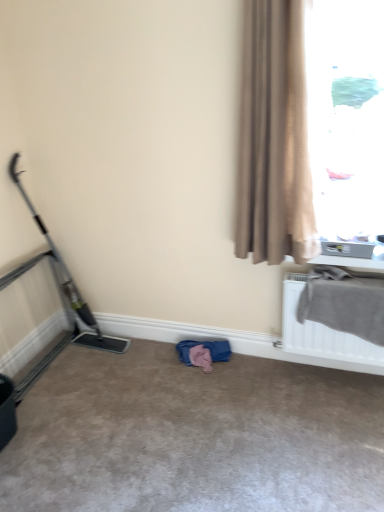
I want to click on beige textured curtain at right, so click(275, 136).

This screenshot has height=512, width=384. What do you see at coordinates (194, 436) in the screenshot?
I see `beige carpet at center` at bounding box center [194, 436].

Where is `gray fabric at upper right`? Image resolution: width=384 pixels, height=512 pixels. gray fabric at upper right is located at coordinates (321, 333).

Locate an element on the screen. Image resolution: width=384 pixels, height=512 pixels. beige textured curtain at right is located at coordinates (275, 136).

Do you think beige carpet at center is within beige textured curtain at right, or outside of it?

beige carpet at center is located beyond the bounds of beige textured curtain at right.

Measure the distance between beige carpet at center and beige textured curtain at right.

beige carpet at center and beige textured curtain at right are 3.62 feet apart.

Between beige carpet at center and beige textured curtain at right, which one appears on the right side from the viewer's perspective?

beige textured curtain at right is more to the right.

Is beige carpet at center beside beige textured curtain at right?

No, beige carpet at center is not next to beige textured curtain at right.

From a real-world perspective, between translucent glass window at upper right and gray fabric at upper right, who is vertically lower?

From a 3D spatial view, gray fabric at upper right is below.

Is gray fabric at upper right at the back of translucent glass window at upper right?

No, translucent glass window at upper right's orientation is not away from gray fabric at upper right.

Can you confirm if translucent glass window at upper right is positioned to the right of gray fabric at upper right?

Yes.

Considering the relative sizes of beige carpet at center and translucent glass window at upper right in the image provided, is beige carpet at center bigger than translucent glass window at upper right?

Incorrect, beige carpet at center is not larger than translucent glass window at upper right.

Between point (205, 481) and point (362, 96), which one is positioned in front?

The point (205, 481) is closer.

Between beige carpet at center and translucent glass window at upper right, which one appears on the right side from the viewer's perspective?

translucent glass window at upper right.

From the image's perspective, is metallic gray baby carriage at left on beige carpet at center?

Indeed, from the image's perspective, metallic gray baby carriage at left is shown above beige carpet at center.

Is metallic gray baby carriage at left smaller than beige carpet at center?

Yes.

Can you see translucent glass window at upper right touching beige textured curtain at right?

translucent glass window at upper right and beige textured curtain at right are not in contact.

Is point (367, 232) positioned behind point (279, 27)?

Yes, point (367, 232) is behind point (279, 27).

Is translucent glass window at upper right taller or shorter than beige textured curtain at right?

Clearly, translucent glass window at upper right is shorter compared to beige textured curtain at right.

Does point (363, 359) appear closer or farther from the camera than point (33, 372)?

Point (363, 359) is positioned closer to the camera compared to point (33, 372).

Is gray fabric at upper right bigger than metallic gray baby carriage at left?

Incorrect, gray fabric at upper right is not larger than metallic gray baby carriage at left.

Relative to metallic gray baby carriage at left, is gray fabric at upper right in front or behind?

Clearly, gray fabric at upper right is in front of metallic gray baby carriage at left.

Could you tell me if gray fabric at upper right is facing metallic gray baby carriage at left?

No, gray fabric at upper right does not turn towards metallic gray baby carriage at left.

Which is more to the left, beige carpet at center or gray fabric at upper right?

Positioned to the left is beige carpet at center.

Considering the positions of objects beige carpet at center and gray fabric at upper right in the image provided, who is in front, beige carpet at center or gray fabric at upper right?

beige carpet at center is closer to the camera.

Is point (221, 461) closer or farther from the camera than point (320, 349)?

Point (221, 461) is positioned closer to the camera compared to point (320, 349).

How different are the orientations of beige carpet at center and gray fabric at upper right in degrees?

There is a 87.4-degree angle between the facing directions of beige carpet at center and gray fabric at upper right.

Identify the location of concrete that appears below the beige textured curtain at right (from a real-world perspective). The image size is (384, 512). (194, 436).

The image size is (384, 512). Find the location of `radiator on the left of translucent glass window at upper right`. radiator on the left of translucent glass window at upper right is located at coordinates (321, 333).

When comparing their distances from beige carpet at center, does metallic gray baby carriage at left or gray fabric at upper right seem closer?

gray fabric at upper right is positioned closer to the anchor beige carpet at center.

Which object lies nearer to the anchor point metallic gray baby carriage at left, translucent glass window at upper right or beige textured curtain at right?

beige textured curtain at right is closer to metallic gray baby carriage at left.

Based on their spatial positions, is beige textured curtain at right or gray fabric at upper right closer to metallic gray baby carriage at left?

Based on the image, gray fabric at upper right appears to be nearer to metallic gray baby carriage at left.

When comparing their distances from translucent glass window at upper right, does beige textured curtain at right or gray fabric at upper right seem closer?

beige textured curtain at right lies closer to translucent glass window at upper right than the other object.

From the image, which object appears to be nearer to beige carpet at center, translucent glass window at upper right or metallic gray baby carriage at left?

Among the two, metallic gray baby carriage at left is located nearer to beige carpet at center.

From the image, which object appears to be nearer to metallic gray baby carriage at left, gray fabric at upper right or beige textured curtain at right?

gray fabric at upper right is closer to metallic gray baby carriage at left.

Considering their positions, is metallic gray baby carriage at left positioned closer to beige carpet at center than beige textured curtain at right?

metallic gray baby carriage at left lies closer to beige carpet at center than the other object.

Which object lies nearer to the anchor point beige textured curtain at right, translucent glass window at upper right or metallic gray baby carriage at left?

translucent glass window at upper right is closer to beige textured curtain at right.

In order to click on radiator between translucent glass window at upper right and beige carpet at center in the vertical direction in this screenshot , I will do `click(321, 333)`.

Locate an element on the screen. curtain between translucent glass window at upper right and gray fabric at upper right from top to bottom is located at coordinates (275, 136).

Locate an element on the screen. The width and height of the screenshot is (384, 512). curtain situated between metallic gray baby carriage at left and gray fabric at upper right from left to right is located at coordinates (275, 136).

The width and height of the screenshot is (384, 512). Find the location of `radiator between beige textured curtain at right and beige carpet at center from top to bottom`. radiator between beige textured curtain at right and beige carpet at center from top to bottom is located at coordinates (321, 333).